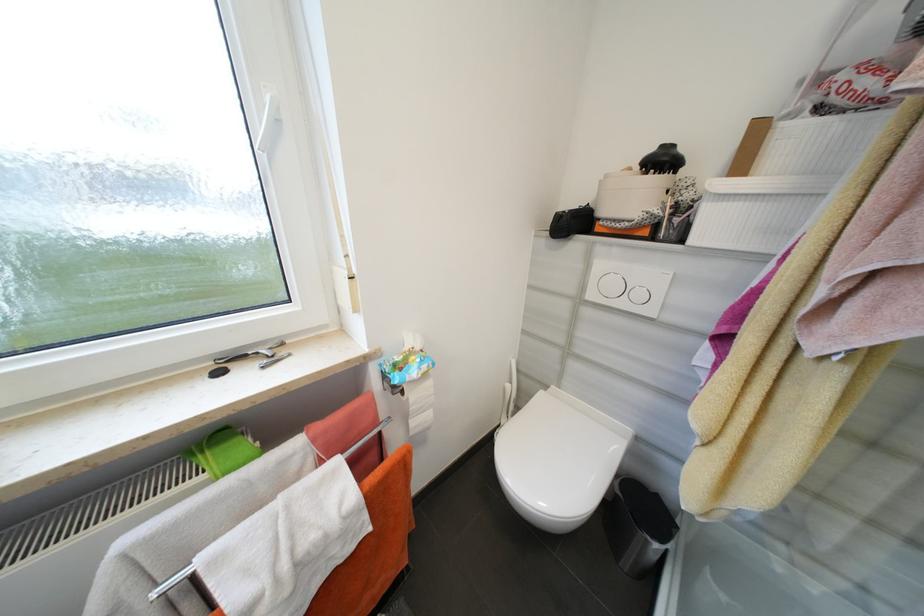
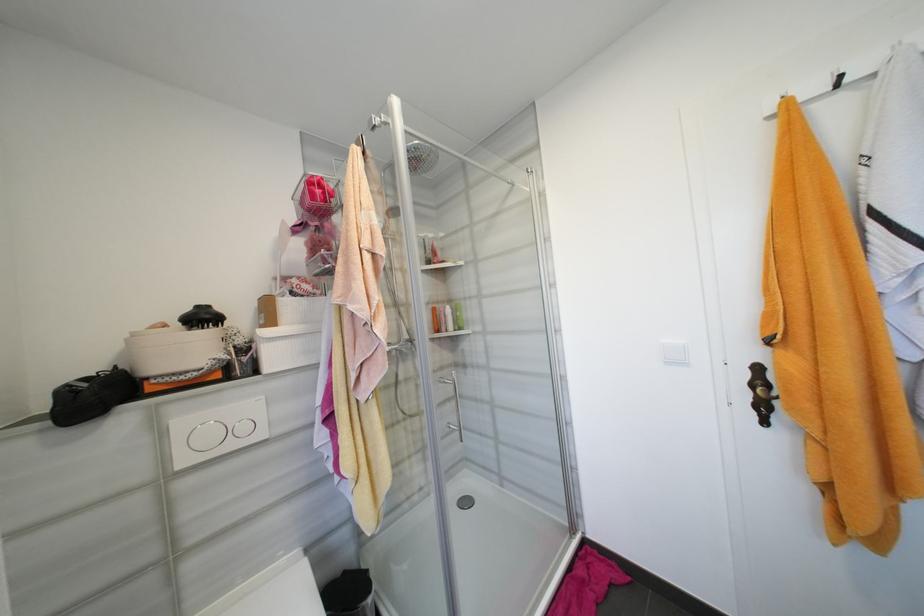
The point at (x=598, y=297) is marked in the first image. Where is the corresponding point in the second image?

(189, 463)